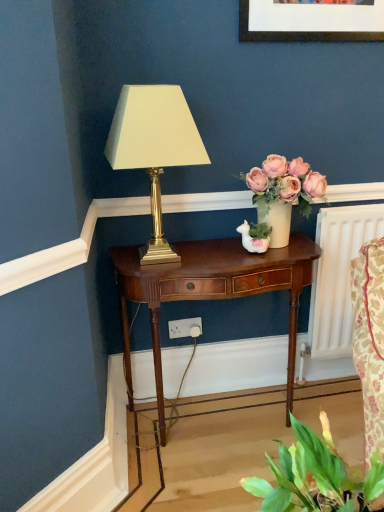
At what (x,y) coordinates should I click in order to perform the action: click on vacant space in front of mahogany wood nightstand at center. Please return your answer as a coordinate pair (x, y). The image size is (384, 512). Looking at the image, I should click on (203, 473).